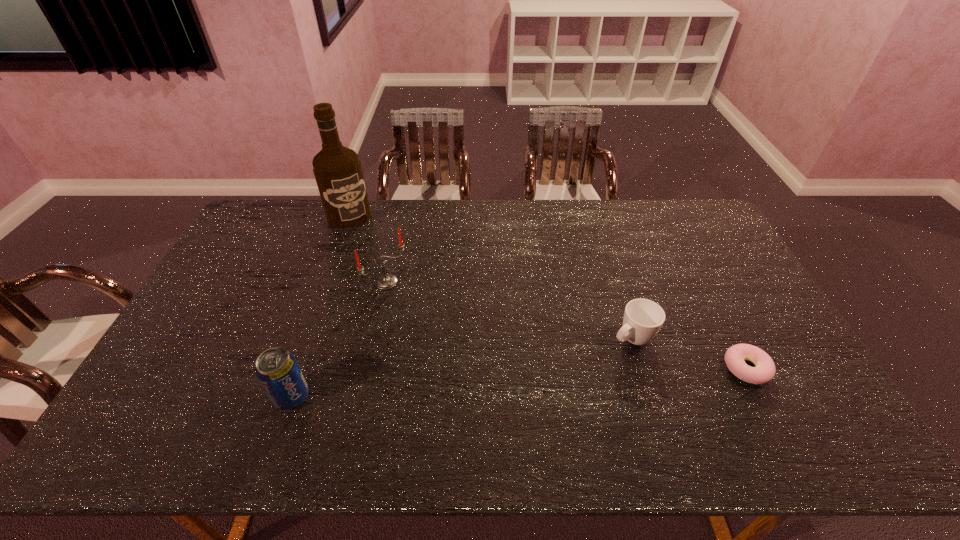
Where is `the third closest object to the soda`? This screenshot has width=960, height=540. the third closest object to the soda is located at coordinates (643, 318).

Where is `object that stands as the closest to the shortest object`? This screenshot has height=540, width=960. object that stands as the closest to the shortest object is located at coordinates (643, 318).

The height and width of the screenshot is (540, 960). I want to click on vacant position in the image that satisfies the following two spatial constraints: 1. on the front side of the third object from right to left; 2. on the left side of the shortest object, so click(x=368, y=368).

You are a GUI agent. You are given a task and a screenshot of the screen. Output one action in this format:
    pyautogui.click(x=<x>, y=<y>)
    Task: Click on the free space that satisfies the following two spatial constraints: 1. on the front side of the alcohol; 2. on the right side of the cup
    The image size is (960, 540).
    Given the screenshot: What is the action you would take?
    pyautogui.click(x=305, y=338)

What are the coordinates of `vacant space that satisfies the following two spatial constraints: 1. on the back side of the soda; 2. on the left side of the second farthest object` in the screenshot? It's located at point(331,282).

Find the location of a particular element. vacant position in the image that satisfies the following two spatial constraints: 1. on the front side of the shortest object; 2. on the left side of the cup is located at coordinates (641, 368).